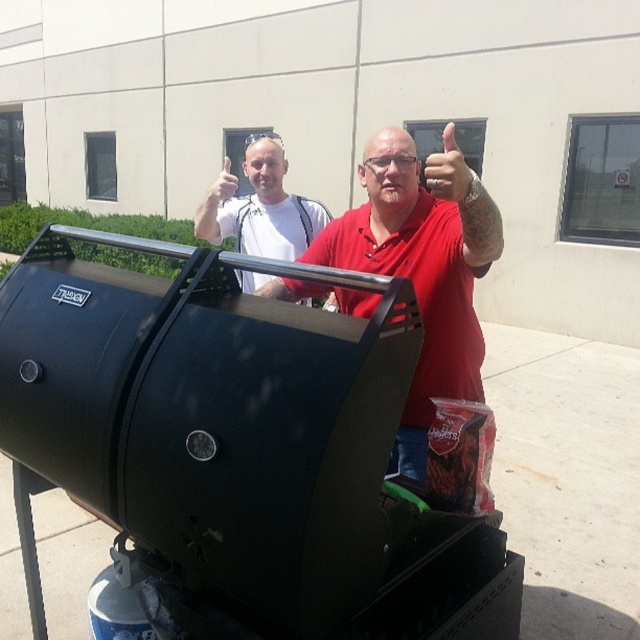
What are the coordinates of the matte black hand at upper center in the image?

The coordinates of the matte black hand at upper center are at point (x=449, y=170).

You are standing in front of the barbecue grill and need to hand a tool to the person wearing the matte red shirt at center. Based on their position, which direction should you walk to approach them?

The matte red shirt at center is located at point (x=419, y=275), so you should walk towards the center of the image to reach them.

You are standing in front of the barbecue grill and want to place a grill brush on the point that is closer to you. Which point should you choose between point [264,236] and point [214,195]?

Point [214,195] is closer to you than point [264,236], so you should place the grill brush on point [214,195].